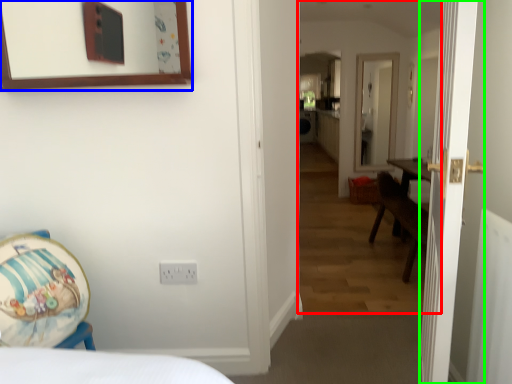
Question: Based on their relative distances, which object is nearer to corridor (highlighted by a red box)? Choose from picture frame (highlighted by a blue box) and door (highlighted by a green box).

Choices:
 (A) picture frame
 (B) door

Answer: (B)